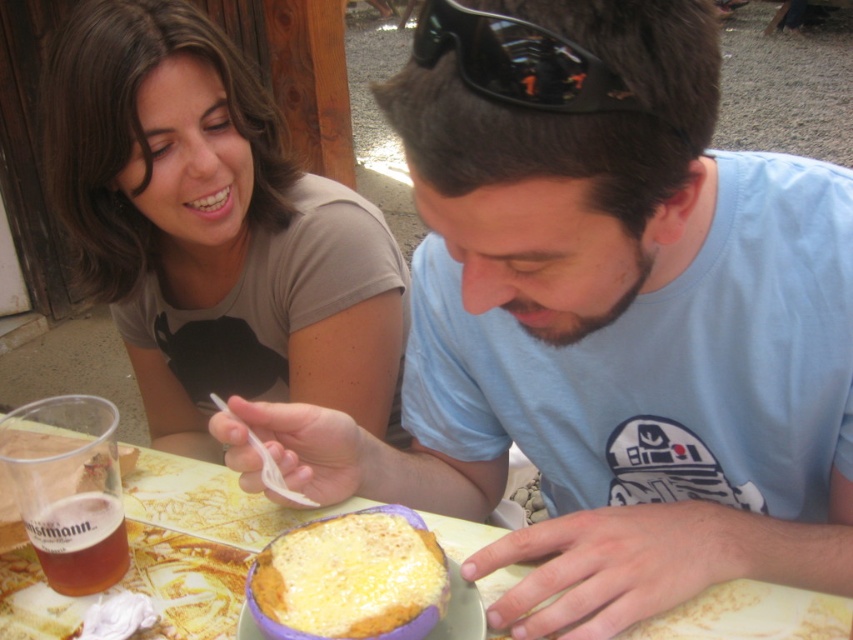
Question: Where is wooden table at center located in relation to translucent plastic cup at lower left in the image?

Choices:
 (A) right
 (B) left

Answer: (A)

Question: Does matte brown shirt at upper left have a larger size compared to wooden table at center?

Choices:
 (A) yes
 (B) no

Answer: (A)

Question: Which point is closer to the camera?

Choices:
 (A) (379, 547)
 (B) (569, 58)
 (C) (834, 609)
 (D) (103, 561)

Answer: (B)

Question: Which object is closer to the camera taking this photo?

Choices:
 (A) black reflective sunglasses at upper center
 (B) matte brown shirt at upper left
 (C) golden cheese bread at center

Answer: (A)

Question: Does golden cheese bread at center have a smaller size compared to translucent plastic cup at lower left?

Choices:
 (A) no
 (B) yes

Answer: (A)

Question: Estimate the real-world distances between objects in this image. Which object is farther from the golden cheese bread at center?

Choices:
 (A) translucent plastic cup at lower left
 (B) wooden table at center
 (C) black reflective sunglasses at upper center
 (D) matte brown shirt at upper left

Answer: (D)